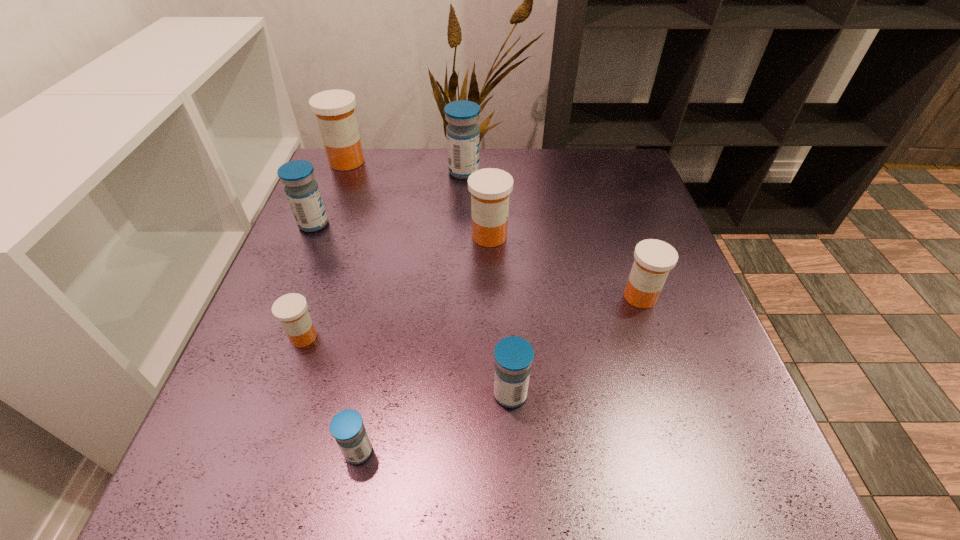
Choose which blue medicine is the second nearest neighbor to the biggest orange medicine. Please provide its 2D coordinates. Your answer should be formatted as a tuple, i.e. [(x, y)], where the tuple contains the x and y coordinates of a point satisfying the conditions above.

[(463, 143)]

Find the location of a particular element. free point that satisfies the following two spatial constraints: 1. on the back side of the nearest medicine; 2. on the label of the biggest orange medicine is located at coordinates (415, 161).

Where is `free space that satisfies the following two spatial constraints: 1. on the label of the biggest orange medicine; 2. on the right side of the third blue medicine from right to left`? Image resolution: width=960 pixels, height=540 pixels. free space that satisfies the following two spatial constraints: 1. on the label of the biggest orange medicine; 2. on the right side of the third blue medicine from right to left is located at coordinates (234, 451).

In order to click on free location that satisfies the following two spatial constraints: 1. on the back side of the nearest object; 2. on the label of the biggest orange medicine in this screenshot , I will do `click(415, 161)`.

Find the location of a particular element. free location that satisfies the following two spatial constraints: 1. on the label of the biggest orange medicine; 2. on the back side of the nearest blue medicine is located at coordinates (234, 451).

In order to click on free point that satisfies the following two spatial constraints: 1. on the front side of the biggest blue medicine; 2. on the left side of the seventh farthest object in this screenshot , I will do `click(454, 394)`.

Where is `free space in the image that satisfies the following two spatial constraints: 1. on the back side of the rightmost blue medicine; 2. on the label of the biggest orange medicine`? free space in the image that satisfies the following two spatial constraints: 1. on the back side of the rightmost blue medicine; 2. on the label of the biggest orange medicine is located at coordinates (498, 161).

Locate an element on the screen. This screenshot has width=960, height=540. vacant region that satisfies the following two spatial constraints: 1. on the label of the fifth farthest object; 2. on the label of the smallest orange medicine is located at coordinates (654, 337).